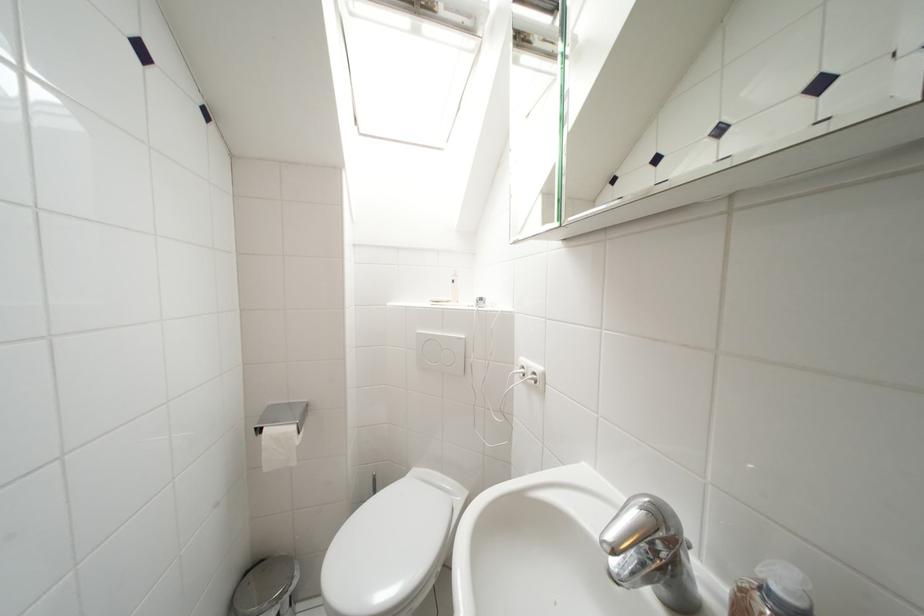
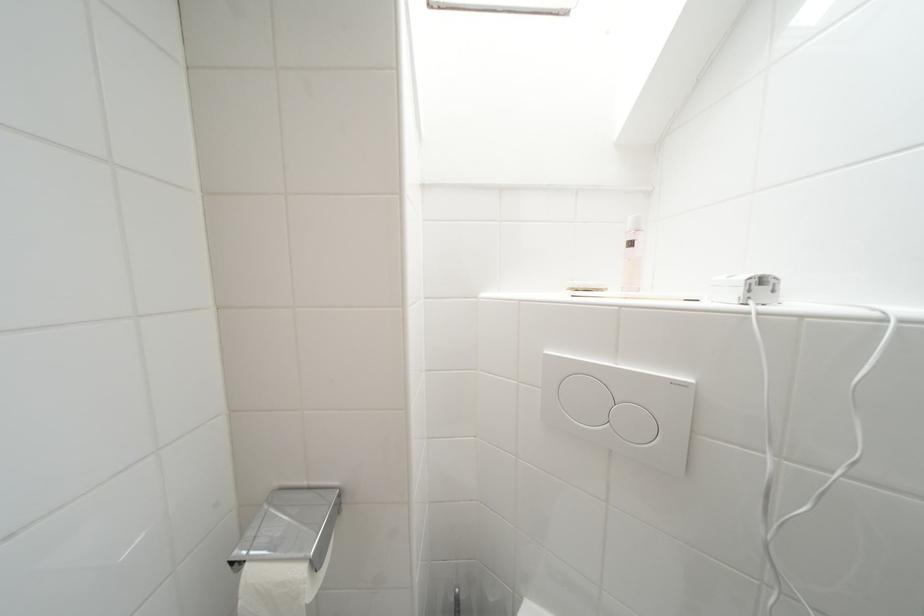
In the second image, find the point that corresponds to [459,285] in the first image.

(638, 246)